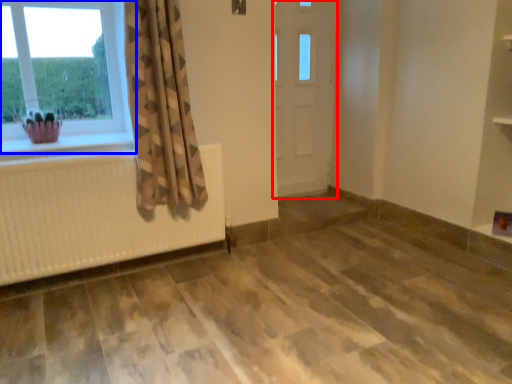
Question: Which point is further to the camera, door (highlighted by a red box) or window (highlighted by a blue box)?

Choices:
 (A) door
 (B) window

Answer: (A)